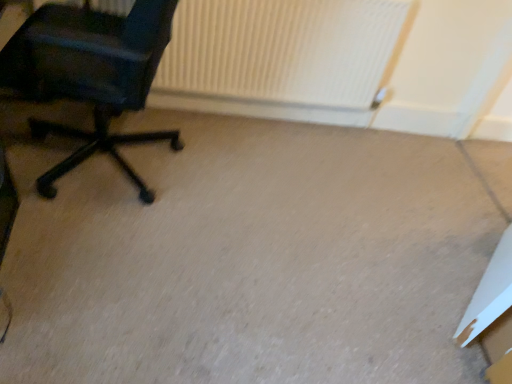
Question: From a real-world perspective, is white cardboard box at lower right on white ribbed radiator at upper center?

Choices:
 (A) no
 (B) yes

Answer: (A)

Question: Is white cardboard box at lower right bigger than white ribbed radiator at upper center?

Choices:
 (A) no
 (B) yes

Answer: (A)

Question: Is white cardboard box at lower right smaller than white ribbed radiator at upper center?

Choices:
 (A) no
 (B) yes

Answer: (B)

Question: From the image's perspective, would you say white cardboard box at lower right is shown under white ribbed radiator at upper center?

Choices:
 (A) no
 (B) yes

Answer: (B)

Question: From a real-world perspective, is white cardboard box at lower right located beneath white ribbed radiator at upper center?

Choices:
 (A) yes
 (B) no

Answer: (A)

Question: Looking at their shapes, would you say beige carpet at center is wider or thinner than white cardboard box at lower right?

Choices:
 (A) wide
 (B) thin

Answer: (A)

Question: Based on their sizes in the image, would you say beige carpet at center is bigger or smaller than white cardboard box at lower right?

Choices:
 (A) big
 (B) small

Answer: (A)

Question: Is beige carpet at center in front of or behind white cardboard box at lower right in the image?

Choices:
 (A) behind
 (B) front

Answer: (B)

Question: Do you think beige carpet at center is within white cardboard box at lower right, or outside of it?

Choices:
 (A) outside
 (B) inside

Answer: (A)

Question: Considering the positions of white cardboard box at lower right and white ribbed radiator at upper center in the image, is white cardboard box at lower right wider or thinner than white ribbed radiator at upper center?

Choices:
 (A) wide
 (B) thin

Answer: (A)

Question: Is point (505, 264) closer or farther from the camera than point (328, 18)?

Choices:
 (A) closer
 (B) farther

Answer: (A)

Question: From the image's perspective, is white cardboard box at lower right above or below white ribbed radiator at upper center?

Choices:
 (A) above
 (B) below

Answer: (B)

Question: Considering their positions, is white cardboard box at lower right located in front of or behind white ribbed radiator at upper center?

Choices:
 (A) behind
 (B) front

Answer: (B)

Question: Based on their sizes in the image, would you say white ribbed radiator at upper center is bigger or smaller than matte black office chair at left?

Choices:
 (A) big
 (B) small

Answer: (B)

Question: From the image's perspective, is white ribbed radiator at upper center above or below matte black office chair at left?

Choices:
 (A) below
 (B) above

Answer: (B)